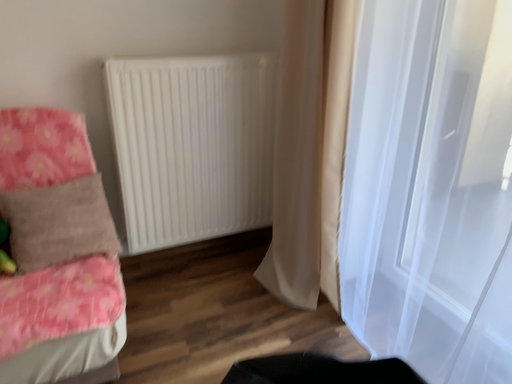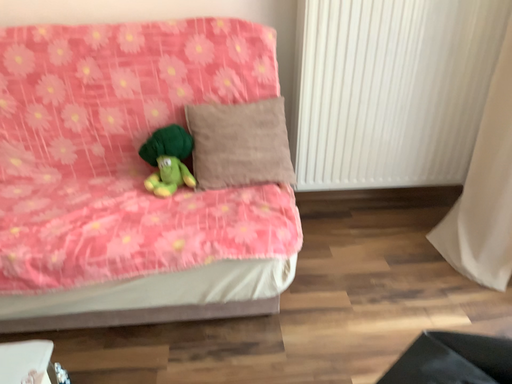
Question: How did the camera likely rotate when shooting the video?

Choices:
 (A) rotated left
 (B) rotated right

Answer: (A)